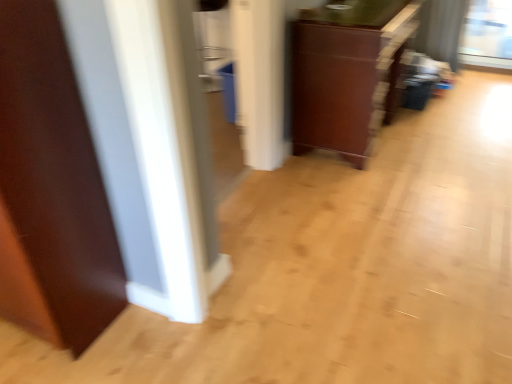
Question: Is matte brown cabinet at center smaller than brown wood door at left?

Choices:
 (A) no
 (B) yes

Answer: (A)

Question: Can you confirm if matte brown cabinet at center is taller than brown wood door at left?

Choices:
 (A) no
 (B) yes

Answer: (A)

Question: From the image's perspective, would you say matte brown cabinet at center is positioned over brown wood door at left?

Choices:
 (A) no
 (B) yes

Answer: (B)

Question: Is matte brown cabinet at center closer to the viewer compared to brown wood door at left?

Choices:
 (A) yes
 (B) no

Answer: (B)

Question: Can you confirm if matte brown cabinet at center is bigger than brown wood door at left?

Choices:
 (A) no
 (B) yes

Answer: (B)

Question: Can you confirm if matte brown cabinet at center is shorter than brown wood door at left?

Choices:
 (A) no
 (B) yes

Answer: (B)

Question: Considering the relative sizes of brown wood door at left and matte brown cabinet at center in the image provided, is brown wood door at left bigger than matte brown cabinet at center?

Choices:
 (A) no
 (B) yes

Answer: (A)

Question: Is brown wood door at left shorter than matte brown cabinet at center?

Choices:
 (A) no
 (B) yes

Answer: (A)

Question: Is matte brown cabinet at center inside brown wood door at left?

Choices:
 (A) no
 (B) yes

Answer: (A)

Question: Could you tell me if brown wood door at left is turned towards matte brown cabinet at center?

Choices:
 (A) yes
 (B) no

Answer: (B)

Question: Is brown wood door at left behind matte brown cabinet at center?

Choices:
 (A) no
 (B) yes

Answer: (A)

Question: Does brown wood door at left appear on the left side of matte brown cabinet at center?

Choices:
 (A) yes
 (B) no

Answer: (A)

Question: Looking at their shapes, would you say brown wood door at left is wider or thinner than matte brown cabinet at center?

Choices:
 (A) wide
 (B) thin

Answer: (B)